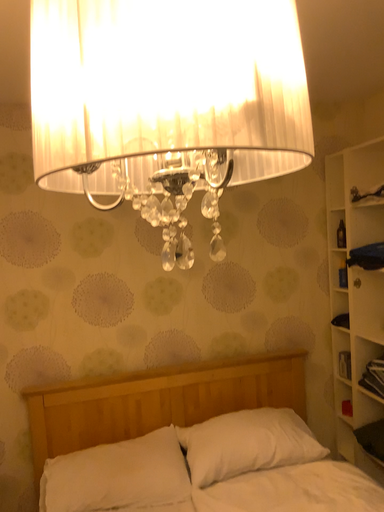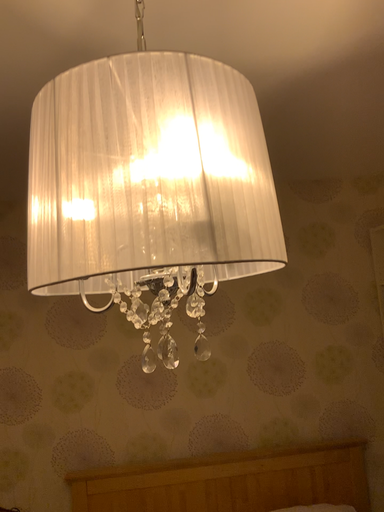
Question: Which way did the camera rotate in the video?

Choices:
 (A) rotated right
 (B) rotated left

Answer: (B)